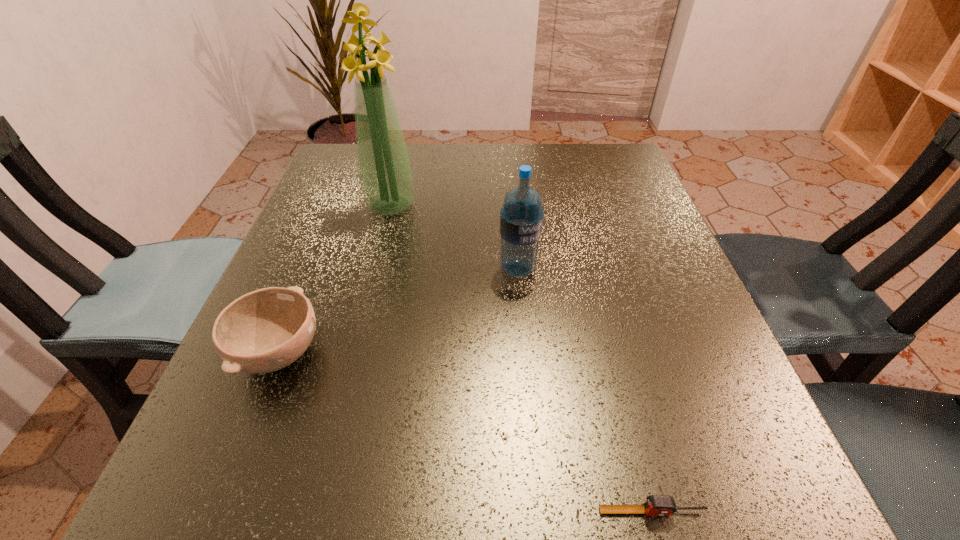
Where is `empty location between the third tallest object and the water bottle`? This screenshot has height=540, width=960. empty location between the third tallest object and the water bottle is located at coordinates (398, 311).

Locate an element on the screen. The width and height of the screenshot is (960, 540). vacant region between the second farthest object and the third farthest object is located at coordinates (398, 311).

Identify the location of free space between the rightmost object and the third tallest object. click(x=466, y=432).

Identify the location of free space between the second tallest object and the bouquet. Image resolution: width=960 pixels, height=540 pixels. (454, 237).

Find the location of `object that stands as the closest to the rightmost object`. object that stands as the closest to the rightmost object is located at coordinates (521, 217).

Identify the location of object identified as the closest to the farthest object. (521, 217).

The width and height of the screenshot is (960, 540). Identify the location of blank area in the image that satisfies the following two spatial constraints: 1. on the front-facing side of the rightmost object; 2. on the right side of the bouquet. (314, 511).

Locate an element on the screen. The image size is (960, 540). free space that satisfies the following two spatial constraints: 1. on the front-facing side of the shortest object; 2. on the right side of the farthest object is located at coordinates (314, 511).

Find the location of a particular element. vacant region that satisfies the following two spatial constraints: 1. on the back side of the second tallest object; 2. on the right side of the bowl is located at coordinates (313, 268).

Find the location of a particular element. Image resolution: width=960 pixels, height=540 pixels. vacant point that satisfies the following two spatial constraints: 1. on the front-facing side of the nearest object; 2. on the left side of the farthest object is located at coordinates (314, 511).